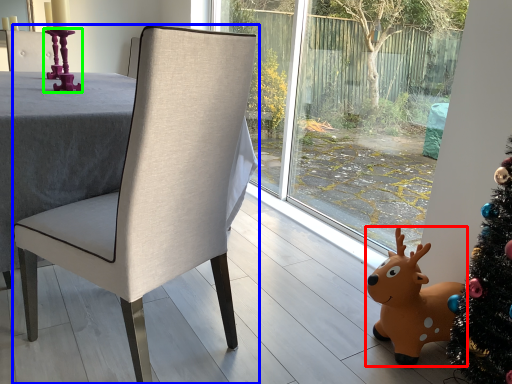
Question: Estimate the real-world distances between objects in this image. Which object is farther from deer (highlighted by a red box), chair (highlighted by a blue box) or candle holder (highlighted by a green box)?

Choices:
 (A) chair
 (B) candle holder

Answer: (B)